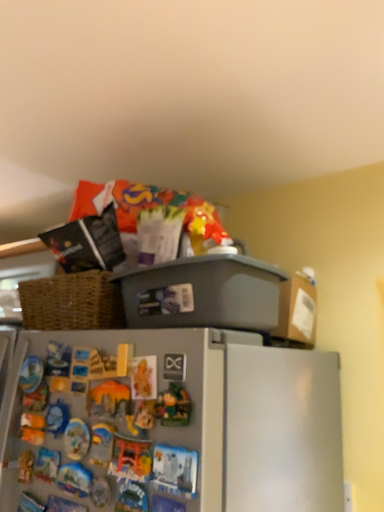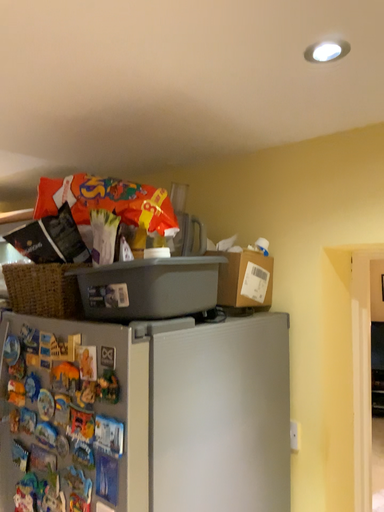
Question: How did the camera likely rotate when shooting the video?

Choices:
 (A) rotated downward
 (B) rotated upward

Answer: (A)